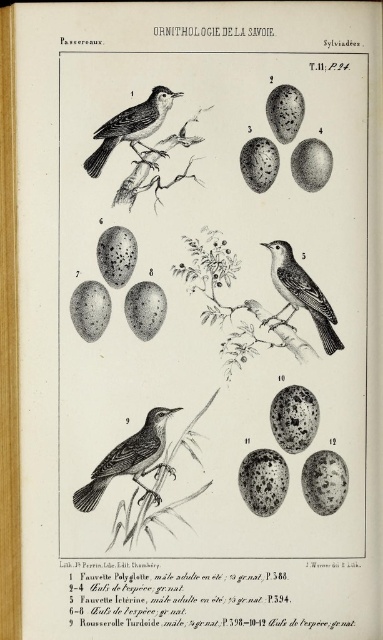
From the picture: Based on the illustration from the book, where is the brown textured bird at center located relative to the smooth black bird at upper left?

The brown textured bird at center is positioned on the right side of smooth black bird at upper left.